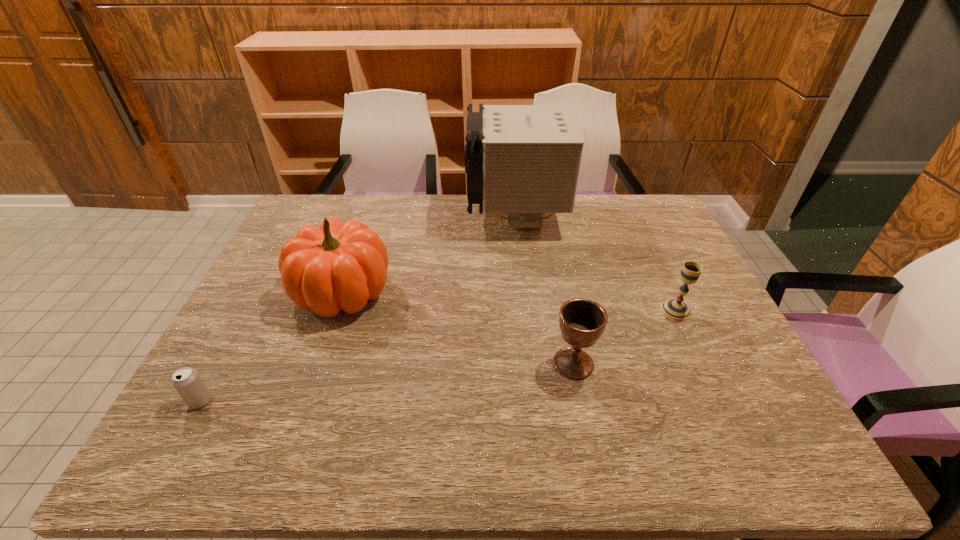
Where is `the farthest object`? Image resolution: width=960 pixels, height=540 pixels. the farthest object is located at coordinates (523, 161).

I want to click on fan, so click(x=523, y=161).

The image size is (960, 540). What are the coordinates of `the second tallest object` in the screenshot? It's located at (338, 266).

Where is `pumpkin`? pumpkin is located at coordinates (338, 266).

Where is `the left chalice`? the left chalice is located at coordinates pos(582,321).

This screenshot has width=960, height=540. Find the location of `the nearer chalice`. the nearer chalice is located at coordinates (582, 321).

Image resolution: width=960 pixels, height=540 pixels. Find the location of `the right chalice`. the right chalice is located at coordinates (674, 309).

Locate an element on the screen. This screenshot has width=960, height=540. the rightmost object is located at coordinates (674, 309).

Find the location of a particular element. Image resolution: width=960 pixels, height=540 pixels. beer can is located at coordinates (187, 381).

Image resolution: width=960 pixels, height=540 pixels. I want to click on the shortest object, so click(187, 381).